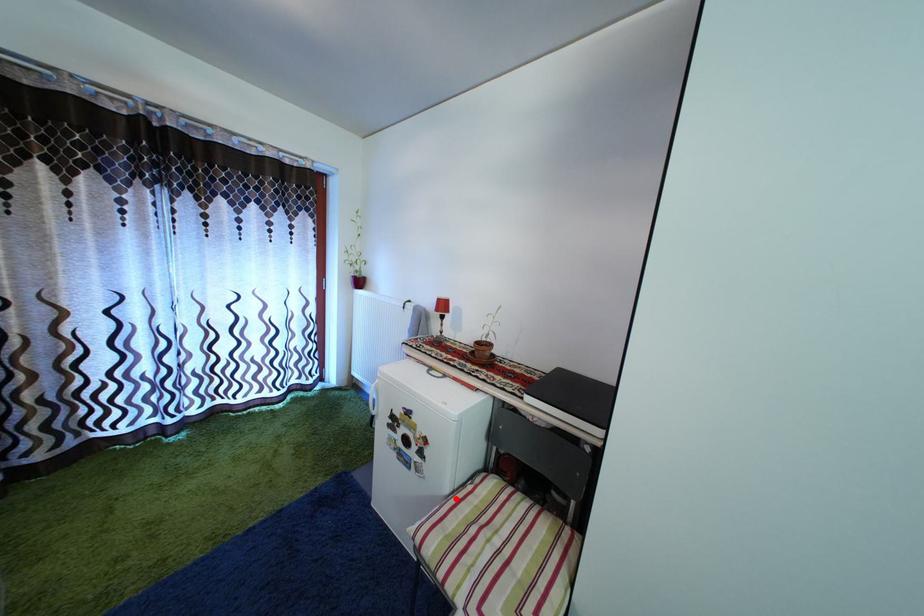
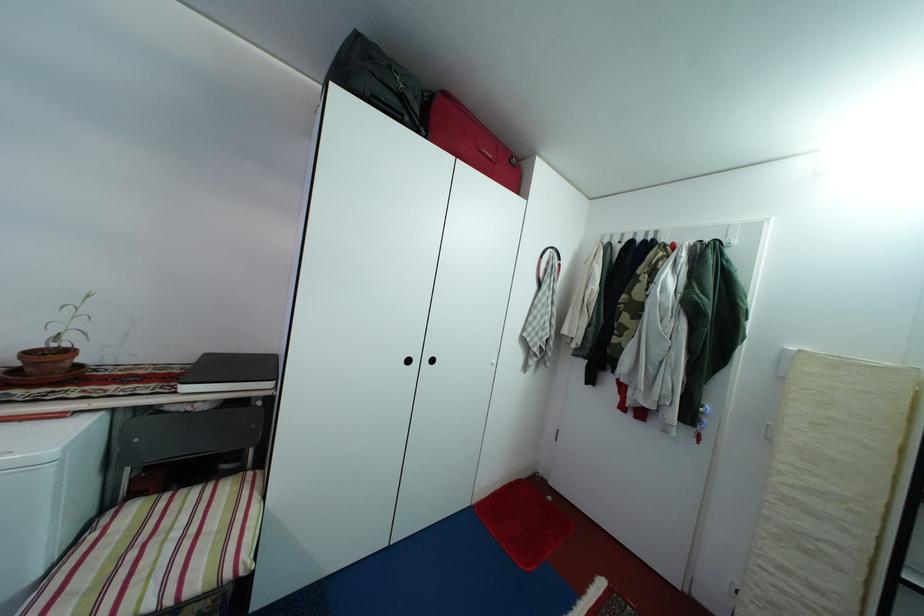
The point at the highlighted location is marked in the first image. Where is the corresponding point in the second image?

(47, 581)